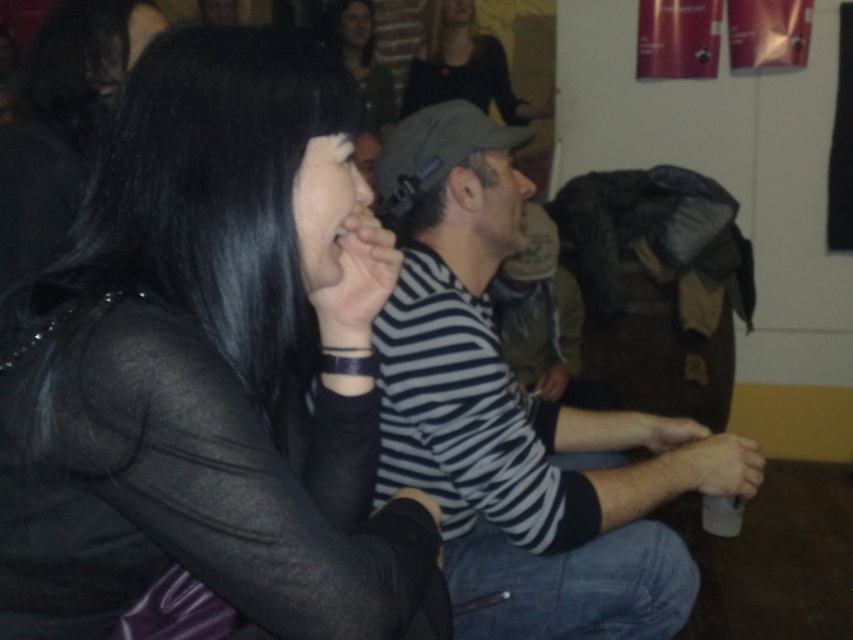
Can you confirm if striped fabric shirt at center is thinner than matte black hair at upper center?

No.

Is point (434, 333) positioned after point (332, 20)?

No, (434, 333) is closer to viewer.

Is point (637, 516) positioned before point (355, 26)?

Yes, point (637, 516) is closer to viewer.

Where is `striped fabric shirt at center`? This screenshot has height=640, width=853. striped fabric shirt at center is located at coordinates (508, 420).

Identify the location of striped fabric shirt at center. (508, 420).

Does point (485, 497) come in front of point (663, 460)?

Yes, point (485, 497) is in front of point (663, 460).

At what (x,y) coordinates should I click in order to perform the action: click on striped fabric shirt at center. Please return your answer as a coordinate pair (x, y). This screenshot has height=640, width=853. Looking at the image, I should click on (508, 420).

Between striped fabric shirt at center and white matte cup at lower center, which one has less height?

white matte cup at lower center

Is striped fabric shirt at center further to the viewer compared to white matte cup at lower center?

No, striped fabric shirt at center is closer to the viewer.

Is point (376, 340) behind point (666, 426)?

No, it is in front of (666, 426).

Where is `striped fabric shirt at center`? The image size is (853, 640). striped fabric shirt at center is located at coordinates (508, 420).